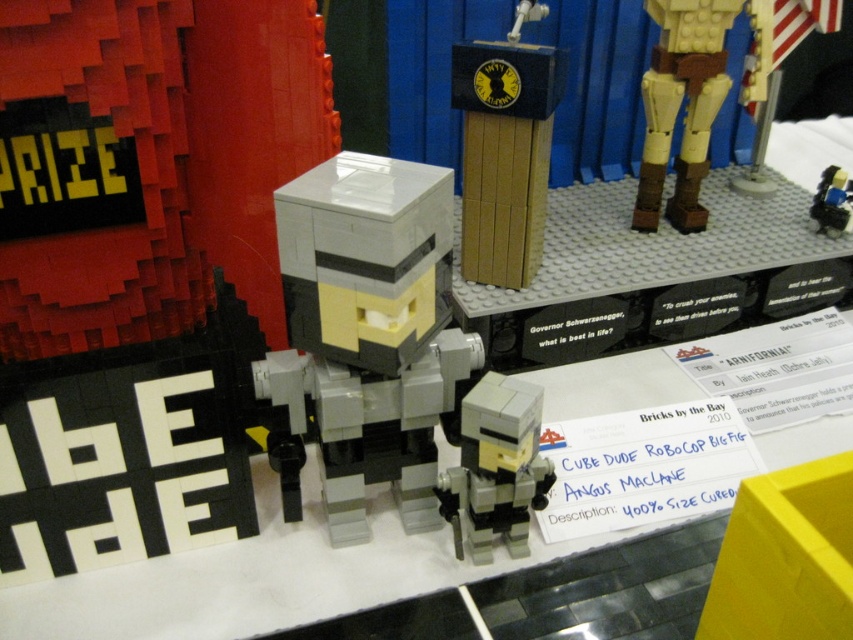
Does tan/leather-likerobot leg at right have a greater width compared to matte black figure at center?

Yes.

Is tan/leather-likerobot leg at right closer to camera compared to matte black figure at center?

Yes, it is in front of matte black figure at center.

Which is behind, point (668, 36) or point (846, 195)?

The point (846, 195) is behind.

You are a GUI agent. You are given a task and a screenshot of the screen. Output one action in this format:
    pyautogui.click(x=<x>, y=<y>)
    Task: Click on the tan/leather-likerobot leg at right
    This screenshot has width=853, height=640.
    Given the screenshot: What is the action you would take?
    pyautogui.click(x=679, y=106)

Can you confirm if white matte robocop at center is wider than yellow plastic flag at upper right?

No.

Is point (331, 259) positioned after point (769, 52)?

No, (331, 259) is closer to viewer.

The height and width of the screenshot is (640, 853). In order to click on white matte robocop at center in this screenshot , I will do `click(369, 330)`.

Is yellow plastic flag at upper right behind matte black figure at center?

That is False.

Who is positioned more to the left, yellow plastic flag at upper right or matte black figure at center?

yellow plastic flag at upper right

Is point (817, 17) positioned in front of point (820, 182)?

That is False.

Find the location of `yellow plastic flag at upper right`. yellow plastic flag at upper right is located at coordinates (775, 68).